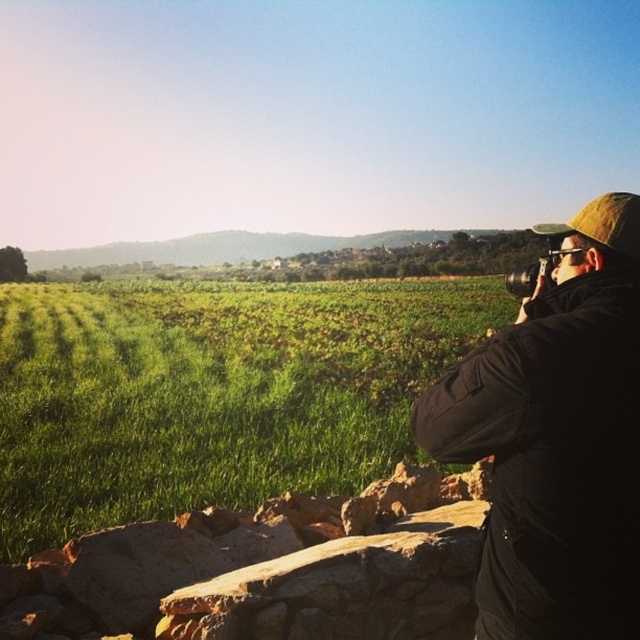
You are standing in the rural landscape scene and want to place a small flag at the point closer to you between the two points marked as point (576, 580) and point (509, 285). Which point should you choose?

You should choose point (576, 580) because it is closer to the viewer than point (509, 285).

You are standing in the rural landscape and want to take a photo of the field. You have two cameras available. Which camera, the black fabric camera at right or the black plastic camera at upper right, is easier to reach without moving your position?

The black fabric camera at right is closer to the viewer than the black plastic camera at upper right, so it is easier to reach without moving your position.